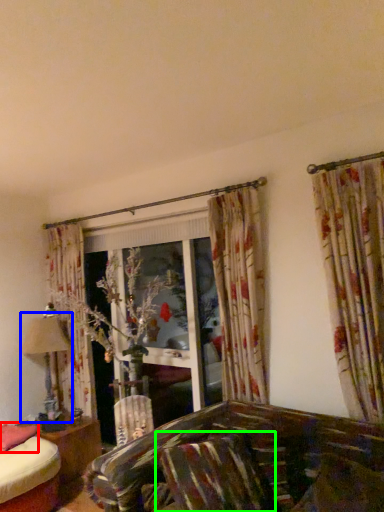
Question: Which is nearer to the pillow (highlighted by a red box)? table lamp (highlighted by a blue box) or pillow (highlighted by a green box).

Choices:
 (A) table lamp
 (B) pillow

Answer: (A)